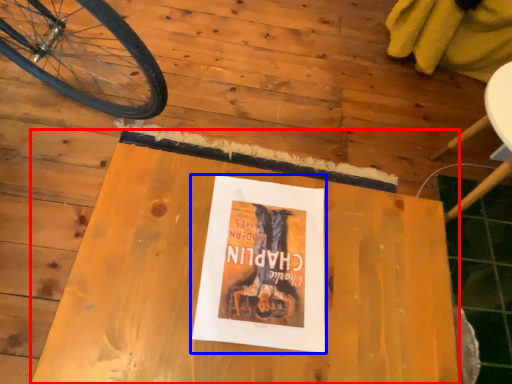
Question: Which point is further to the camera, table (highlighted by a red box) or paperback book (highlighted by a blue box)?

Choices:
 (A) table
 (B) paperback book

Answer: (B)